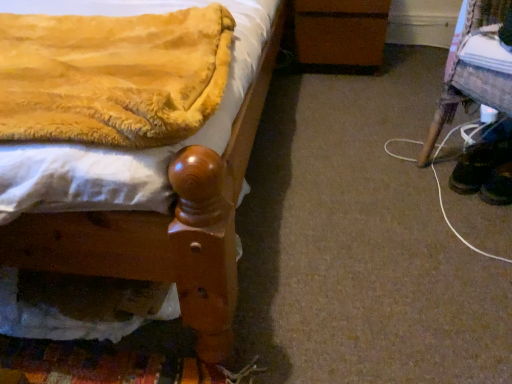
Locate an element on the screen. vacant space to the left of wooden stool at lower right is located at coordinates (381, 180).